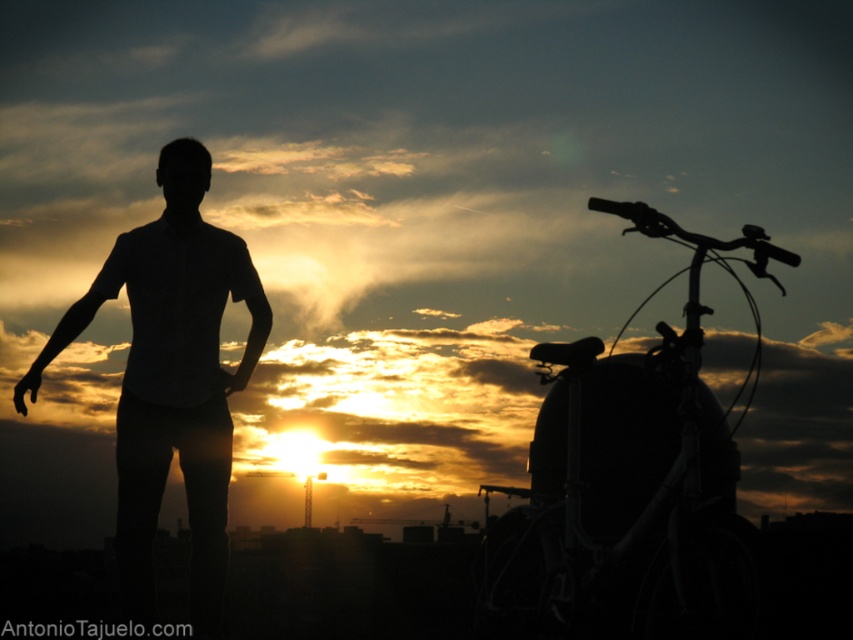
Is point (692, 580) closer to viewer compared to point (193, 225)?

Yes, point (692, 580) is in front of point (193, 225).

Who is more distant from viewer, (630, 442) or (212, 330)?

The point (630, 442) is more distant.

Is point (677, 477) positioned in front of point (242, 282)?

Yes, point (677, 477) is closer to viewer.

Find the location of a particular element. silhouette metallic bicycle at right is located at coordinates (630, 488).